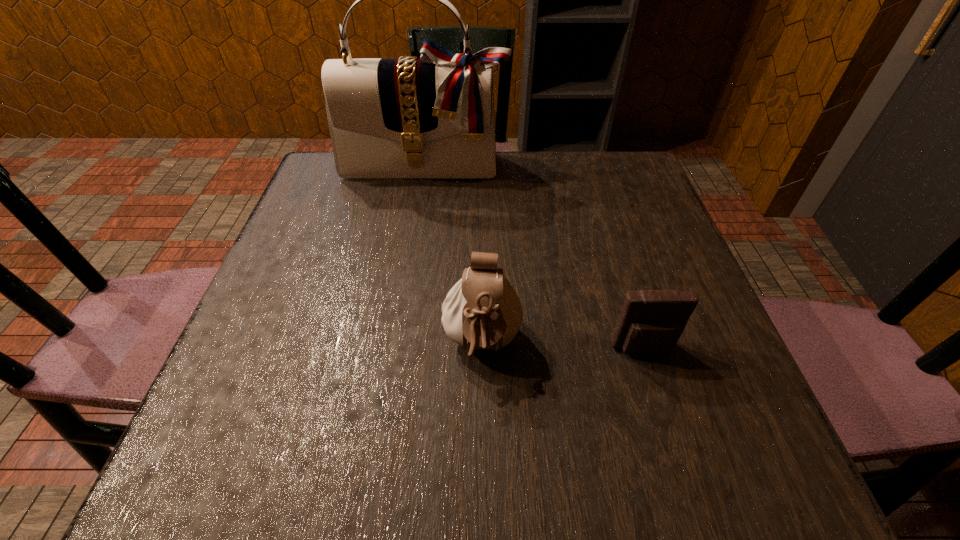
Image resolution: width=960 pixels, height=540 pixels. Identify the location of object present at the left edge. (433, 117).

Locate an element on the screen. object present at the right edge is located at coordinates (651, 322).

The image size is (960, 540). I want to click on object at the far left corner, so pyautogui.click(x=433, y=117).

In the image, there is a desktop. Find the location of `vacant space at the far edge`. vacant space at the far edge is located at coordinates (422, 185).

In the image, there is a desktop. Where is `vacant space at the near edge`? vacant space at the near edge is located at coordinates (310, 431).

In the image, there is a desktop. Where is `free region at the left edge`? The image size is (960, 540). free region at the left edge is located at coordinates (264, 307).

In the image, there is a desktop. Where is `vacant space at the right edge`? Image resolution: width=960 pixels, height=540 pixels. vacant space at the right edge is located at coordinates (653, 255).

At what (x,y) coordinates should I click in order to perform the action: click on free space at the far left corner. Please return your answer as a coordinate pair (x, y). Looking at the image, I should click on pyautogui.click(x=325, y=180).

Image resolution: width=960 pixels, height=540 pixels. I want to click on free region at the far right corner of the desktop, so click(x=627, y=172).

The image size is (960, 540). Identify the location of free space between the tallest object and the left pouch. (453, 255).